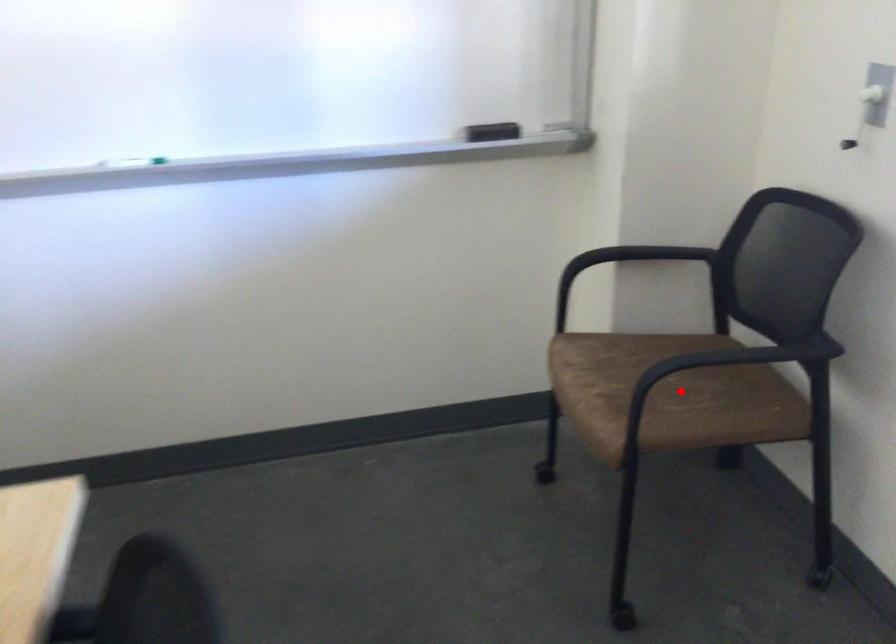
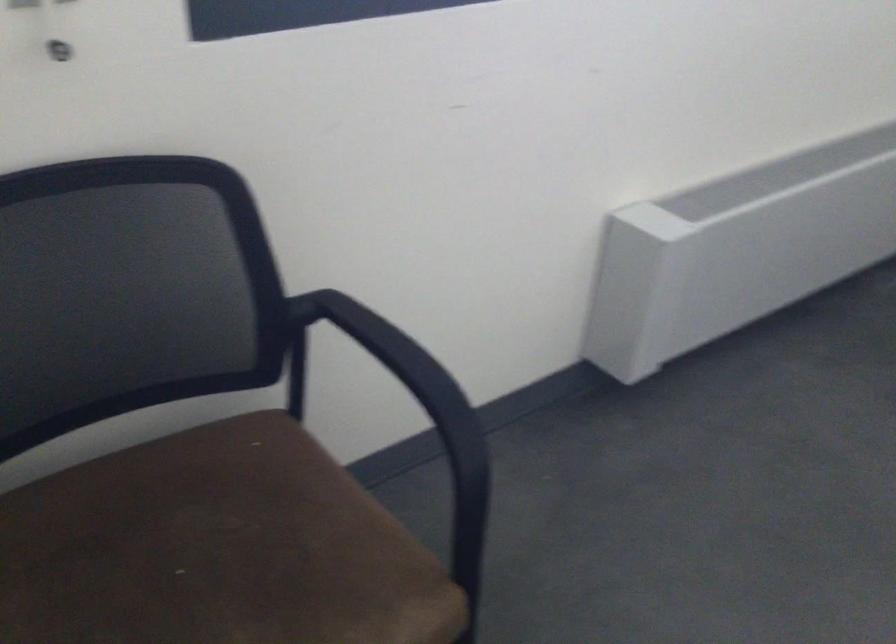
The point at the highlighted location is marked in the first image. Where is the corresponding point in the second image?

(216, 549)